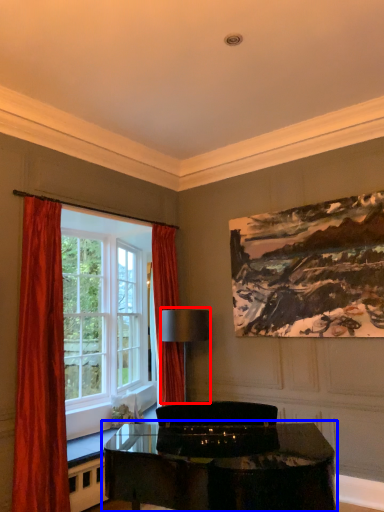
Question: Which of the following is the farthest to the observer, lamp (highlighted by a red box) or table (highlighted by a blue box)?

Choices:
 (A) lamp
 (B) table

Answer: (A)